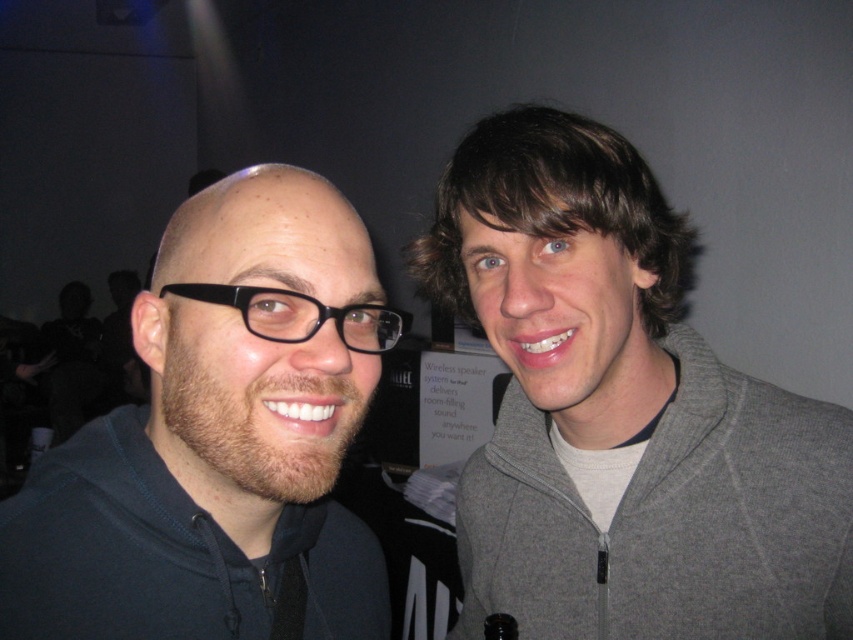
You are a photographer trying to adjust the lighting for a group photo. You notice the matte black hoodie at left and the gray fleece jacket at right. Which clothing item should you focus on first to ensure proper exposure, considering their positions relative to each other?

The matte black hoodie at left should be focused on first because it is positioned to the left of the gray fleece jacket at right, and in low light, darker clothing may require more attention to avoid underexposure.

You are a photographer trying to capture a group photo of two people standing at the point (321, 308). The minimum distance required for your camera lens to focus properly is 50 centimeters. Based on their current positions, will the camera be able to focus on both subjects simultaneously?

The two individuals are 45.27 centimeters apart, which is less than the required 50 centimeters for the camera lens to focus properly. Therefore, the camera may not be able to focus on both subjects simultaneously.